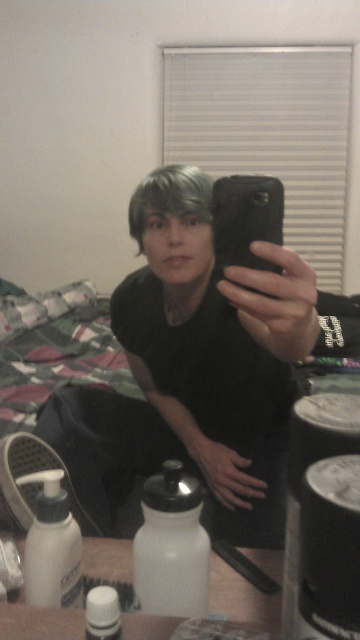
Is point (208, 403) closer to viewer compared to point (100, 604)?

No, (208, 403) is further to viewer.

Who is higher up, black matte phone at center or white matte water bottle at lower center?

black matte phone at center

You are a GUI agent. You are given a task and a screenshot of the screen. Output one action in this format:
    pyautogui.click(x=<x>, y=<y>)
    Task: Click on the black matte phone at center
    
    Given the screenshot: What is the action you would take?
    pyautogui.click(x=191, y=369)

The image size is (360, 640). What are the coordinates of `white matte bottle at center` in the screenshot? It's located at (172, 545).

Between white plastic pump bottle at lower left and white matte water bottle at lower center, which one has more height?

With more height is white plastic pump bottle at lower left.

Does white plastic pump bottle at lower left lie in front of white matte water bottle at lower center?

No, it is not.

Where is `white plastic pump bottle at lower left`? The image size is (360, 640). white plastic pump bottle at lower left is located at coordinates (51, 545).